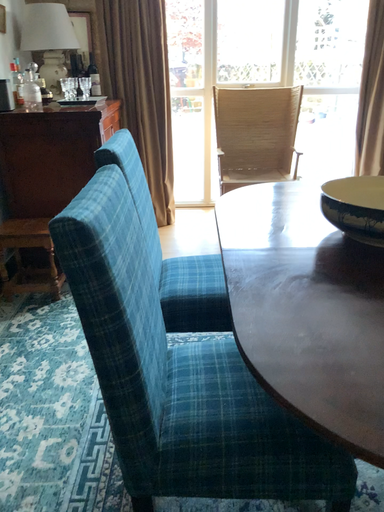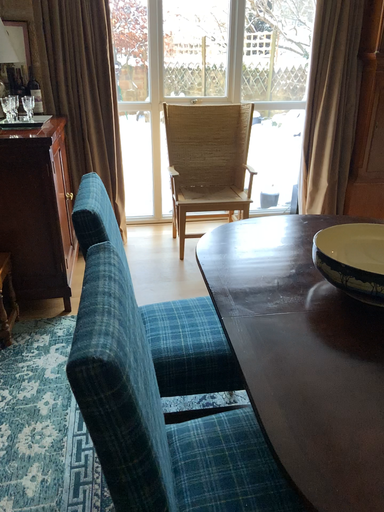
Question: Which way did the camera rotate in the video?

Choices:
 (A) rotated left
 (B) rotated right

Answer: (B)